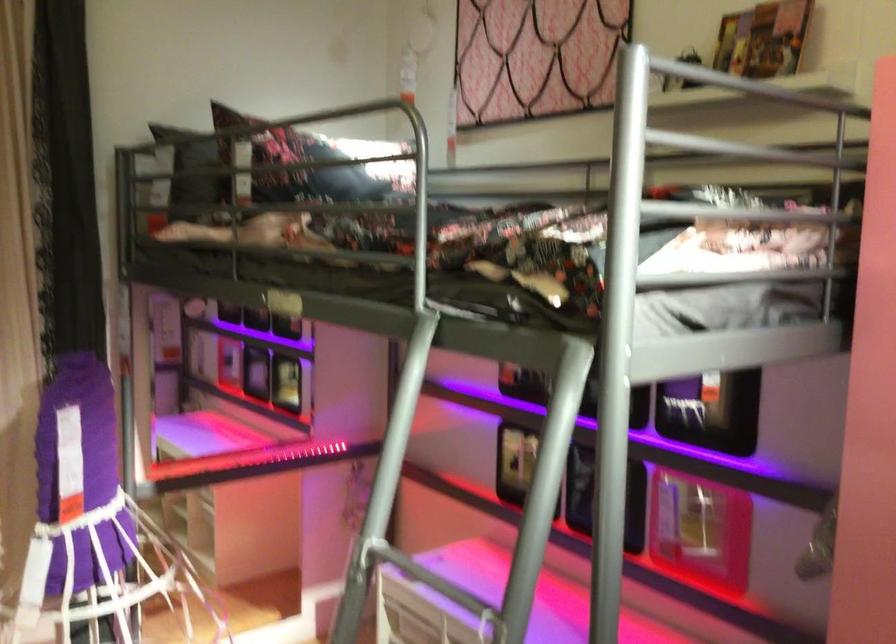
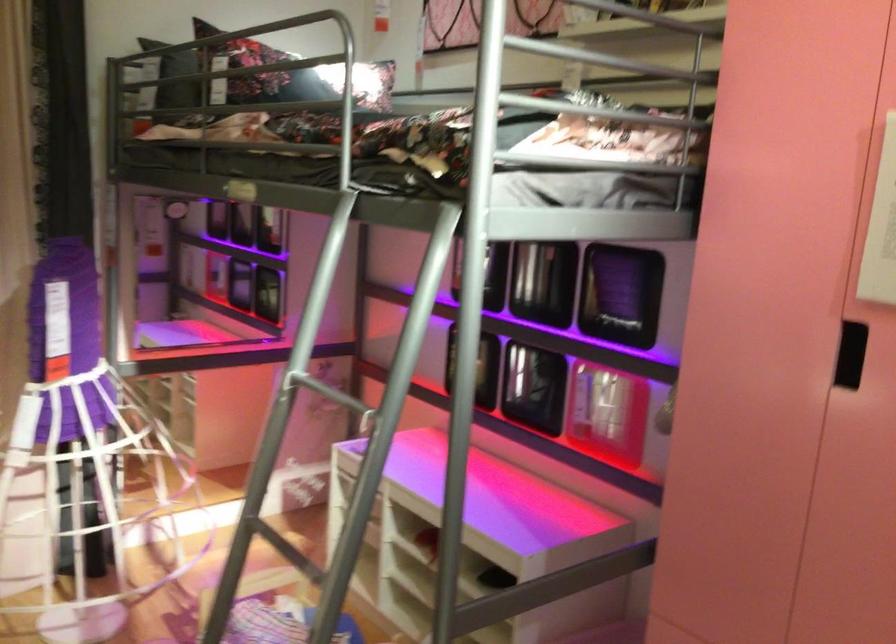
In the second image, find the point that corresponds to the point at 545,453 in the first image.

(420, 292)